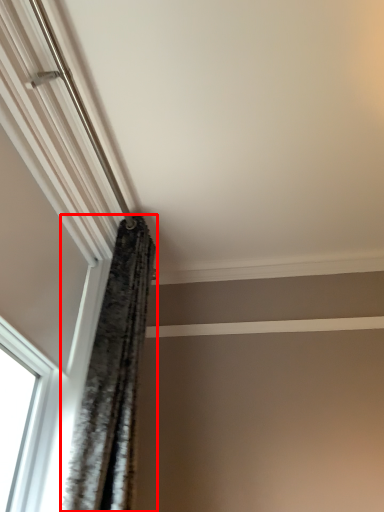
Question: From the image, what is the correct spatial relationship of curtain (annotated by the red box) in relation to window?

Choices:
 (A) right
 (B) left

Answer: (A)